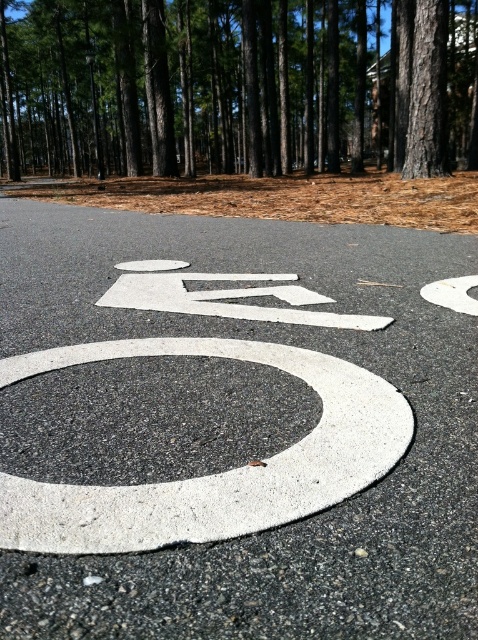
You are standing on the bike lane and want to move from the point at coordinates point (434, 13) to the point at coordinates point (117, 493). Which direction should you move to get closer to the latter point?

To move from point (434, 13) to point (117, 493), you should move towards the lower right direction since point (117, 493) is closer to the viewer compared to point (434, 13).

You are standing at the edge of the bike lane and want to take a photo of the bike symbol. Which point, point (218, 497) or point (137, 275), is closer to your camera lens?

Point (218, 497) is closer to the camera lens than point (137, 275).